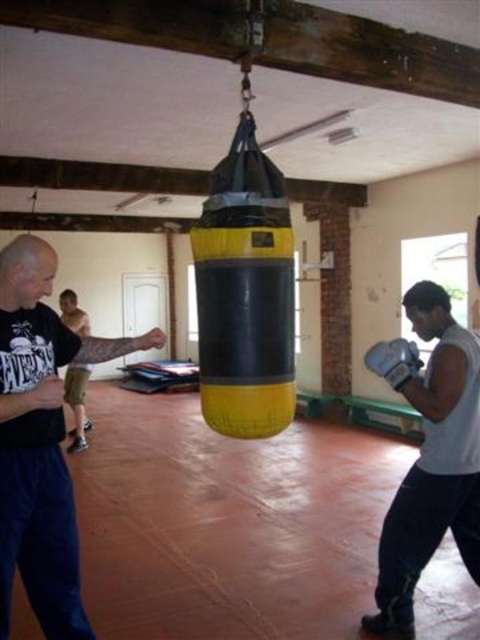
Is matte black shirt at left below white matte boxing gloves at center?

No.

Is matte black shirt at left taller than white matte boxing gloves at center?

No.

Who is more distant from viewer, (x=33, y=282) or (x=415, y=516)?

Positioned behind is point (x=415, y=516).

Where is `matte black shirt at left`? matte black shirt at left is located at coordinates (40, 440).

Does white matte boxing gloves at center have a lesser height compared to white synthetic boxing glove at lower right?

Incorrect, white matte boxing gloves at center's height does not fall short of white synthetic boxing glove at lower right's.

Between point (389, 595) and point (372, 348), which one is positioned behind?

Positioned behind is point (372, 348).

Who is more forward, (x=404, y=294) or (x=386, y=356)?

→ Point (x=386, y=356) is more forward.

Locate an element on the screen. white matte boxing gloves at center is located at coordinates (431, 460).

Does matte black shirt at left have a greater width compared to white synthetic boxing glove at lower right?

Correct, the width of matte black shirt at left exceeds that of white synthetic boxing glove at lower right.

Which is behind, point (57, 589) or point (394, 372)?

The point (394, 372) is behind.

Where is `matte black shirt at left`? This screenshot has width=480, height=640. matte black shirt at left is located at coordinates (40, 440).